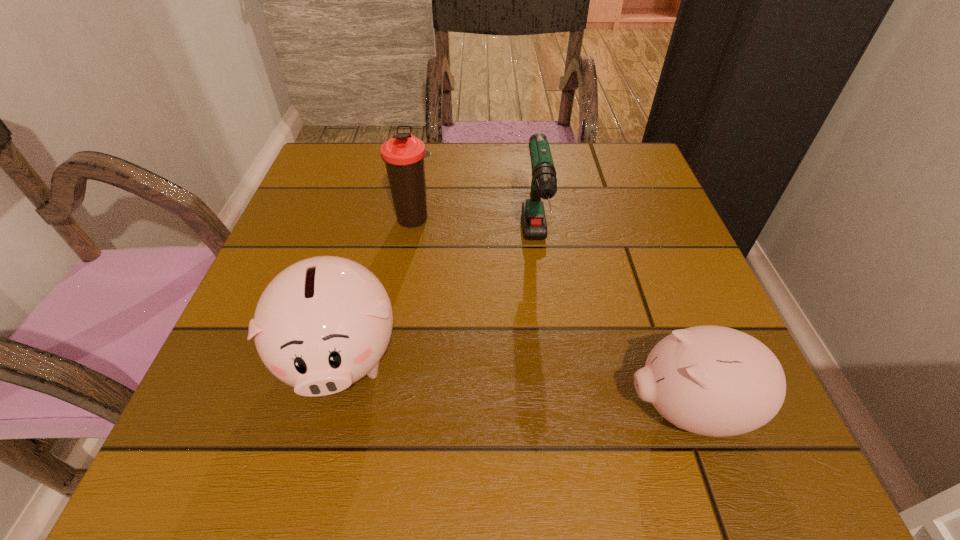
At what (x,y) coordinates should I click in order to perform the action: click on thermos bottle. Please return your answer as a coordinate pair (x, y). Image resolution: width=960 pixels, height=540 pixels. Looking at the image, I should click on (x=403, y=154).

Identify the location of the second object from right to left. (544, 182).

Where is `the taller piggy bank`? the taller piggy bank is located at coordinates [x=323, y=323].

You are a GUI agent. You are given a task and a screenshot of the screen. Output one action in this format:
    pyautogui.click(x=<x>, y=<y>)
    Task: Click on the rightmost object
    The height and width of the screenshot is (540, 960).
    Given the screenshot: What is the action you would take?
    pyautogui.click(x=716, y=381)

Where is `the right piggy bank`? This screenshot has height=540, width=960. the right piggy bank is located at coordinates (716, 381).

You are a GUI agent. You are given a task and a screenshot of the screen. Output one action in this format:
    pyautogui.click(x=<x>, y=<y>)
    Task: Click on the free location located on the front of the thermos bottle
    The image size is (960, 540).
    Given the screenshot: What is the action you would take?
    pyautogui.click(x=405, y=281)

Find the location of `vacant space positioned 0.160m on the handle side of the third object from left to right`. vacant space positioned 0.160m on the handle side of the third object from left to right is located at coordinates (551, 361).

At what (x,y) coordinates should I click in order to perform the action: click on blank area located 0.230m on the back of the taller piggy bank. Please return your answer as a coordinate pair (x, y). This screenshot has width=960, height=540. Looking at the image, I should click on [x=377, y=218].

At what (x,y) coordinates should I click in order to perform the action: click on vacant point located at the snout of the rightmost object. Please return your answer as a coordinate pair (x, y). The image size is (960, 540). Looking at the image, I should click on (486, 409).

Identify the location of vacant space situated at the snout of the rightmost object. (479, 409).